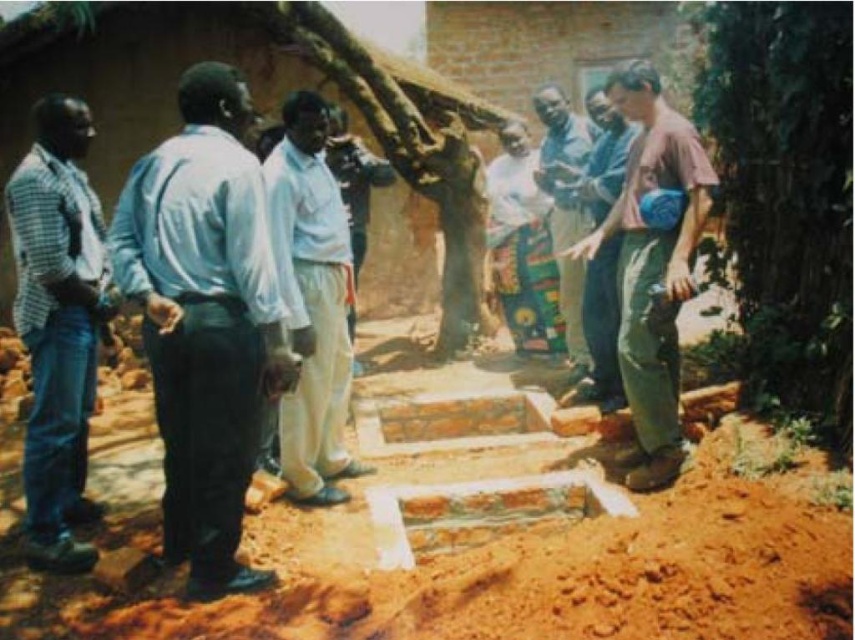
Which is more to the right, light blue shirt at left or pink fabric bag at right?

From the viewer's perspective, pink fabric bag at right appears more on the right side.

Locate an element on the screen. Image resolution: width=855 pixels, height=640 pixels. light blue shirt at left is located at coordinates (204, 320).

Locate an element on the screen. The height and width of the screenshot is (640, 855). light blue shirt at left is located at coordinates click(204, 320).

This screenshot has width=855, height=640. I want to click on light blue shirt at left, so click(x=204, y=320).

Is brown dirt field at center thinner than pink fabric bag at right?

Incorrect, brown dirt field at center's width is not less than pink fabric bag at right's.

How much distance is there between brown dirt field at center and pink fabric bag at right?

brown dirt field at center is 1.29 meters away from pink fabric bag at right.

Is point (827, 528) behind point (668, 136)?

No.

This screenshot has height=640, width=855. Identify the location of brown dirt field at center. (503, 570).

Who is more distant from viewer, (46, 156) or (573, 260)?

Point (573, 260)

Does checkered fabric shirt at left have a lesser height compared to blue fabric pants at center?

Indeed, checkered fabric shirt at left has a lesser height compared to blue fabric pants at center.

The height and width of the screenshot is (640, 855). Find the location of `checkered fabric shirt at left`. checkered fabric shirt at left is located at coordinates (57, 324).